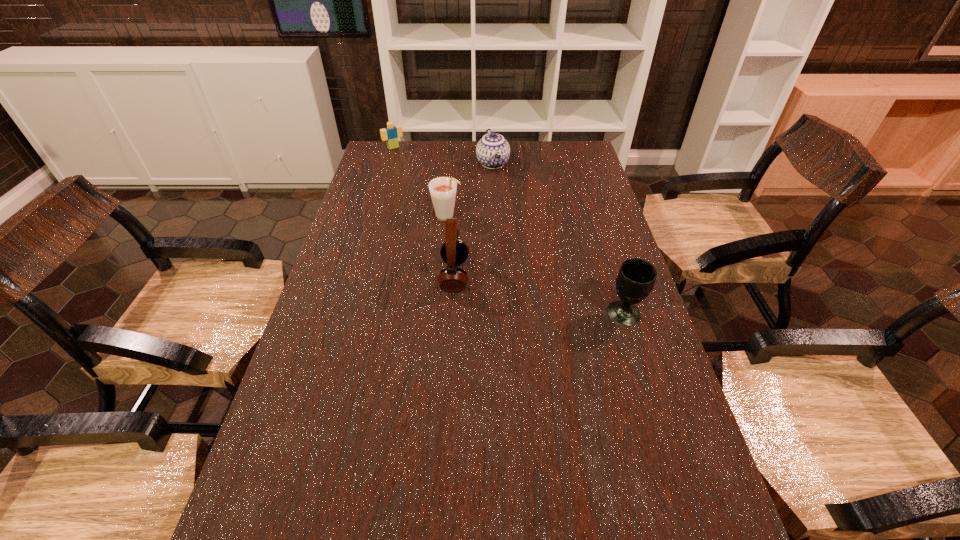
You are a GUI agent. You are given a task and a screenshot of the screen. Output one action in this format:
    pyautogui.click(x=<x>, y=<y>)
    Task: Click on the vacant area that lies between the nearest object and the fourth tallest object
    This screenshot has width=960, height=540.
    Given the screenshot: What is the action you would take?
    pyautogui.click(x=559, y=239)

Where is `vacant space that's between the fourth object from left to right and the headset`? This screenshot has height=540, width=960. vacant space that's between the fourth object from left to right and the headset is located at coordinates (473, 220).

Find the location of a particular element. This screenshot has height=540, width=960. free point between the rightmost object and the third farthest object is located at coordinates (536, 266).

You are a GUI agent. You are given a task and a screenshot of the screen. Output one action in this format:
    pyautogui.click(x=<x>, y=<y>)
    Task: Click on the free point between the nearest object and the third farthest object
    
    Given the screenshot: What is the action you would take?
    pyautogui.click(x=536, y=266)

This screenshot has height=540, width=960. What are the coordinates of `empty space that is in between the headset and the shortest object` in the screenshot? It's located at (424, 212).

I want to click on vacant area between the second object from right to left and the chalice, so click(559, 239).

Select which object appears as the closest to the headset. Please provide its 2D coordinates. Your answer should be formatted as a tuple, i.e. [(x, y)], where the tuple contains the x and y coordinates of a point satisfying the conditions above.

[(442, 189)]

Where is `object that stands as the fourth closest to the headset`? object that stands as the fourth closest to the headset is located at coordinates (391, 133).

What are the coordinates of `vacant area that satisfies the following two spatial constraints: 1. on the front side of the shortest object; 2. on the right side of the rightmost object` in the screenshot? It's located at (345, 314).

The image size is (960, 540). I want to click on vacant space that satisfies the following two spatial constraints: 1. on the front side of the third nearest object; 2. on the left side of the shortest object, so click(373, 218).